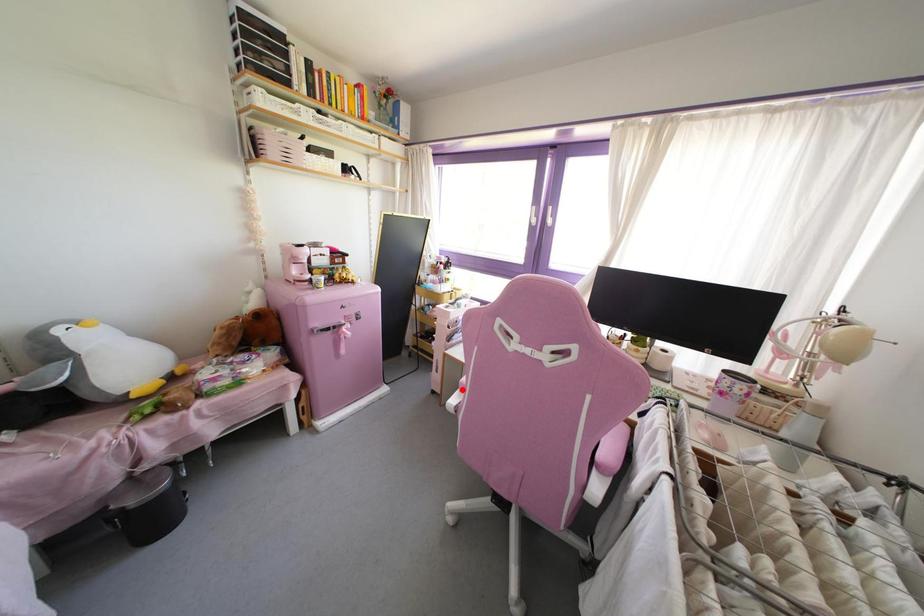
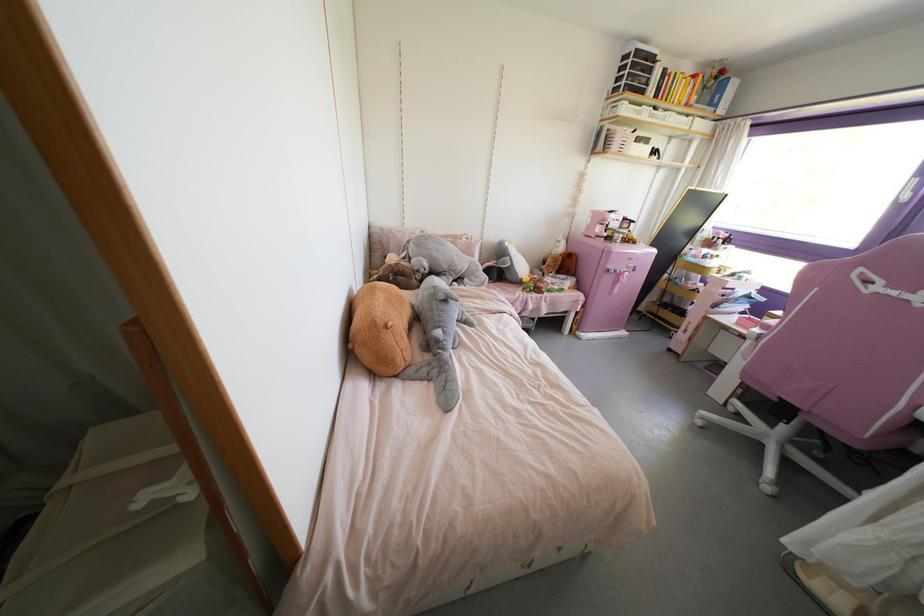
Question: I am providing you with two images of the same scene from different viewpoints. Given a red point in image1, look at the same physical point in image2. Is it:

Choices:
 (A) Closer to the viewpoint
 (B) Farther from the viewpoint

Answer: (B)